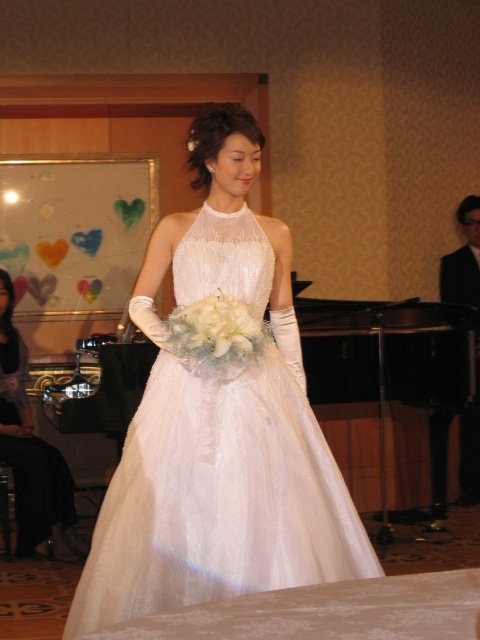
You are standing in the wedding reception hall and want to walk towards the two points marked in the image. Which point, point (188, 541) or point (41, 497), will you reach first?

You will reach point (188, 541) first because it is closer to you than point (41, 497).

You are a photographer at a wedding reception. You need to position a camera at point A to capture the matte white dress at center. According to the coordinates provided, where should you aim your camera?

The matte white dress at center is located at coordinates point A at point (32, 452).

You are a photographer at a wedding reception and need to capture a clear shot of both the white satin dress at center and the matte white dress at center. Since the dresses are positioned at the same central area, which one will appear larger in your photo?

The white satin dress at center will appear larger in the photo because it is closer to the viewer than the matte white dress at center.